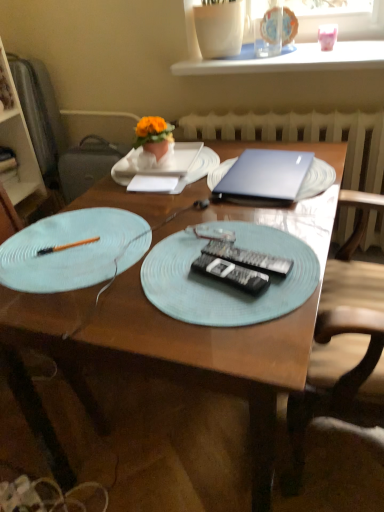
The height and width of the screenshot is (512, 384). I want to click on free space that is to the left of black plastic remote control at center, acting as the first remote control starting from the top, so click(x=163, y=274).